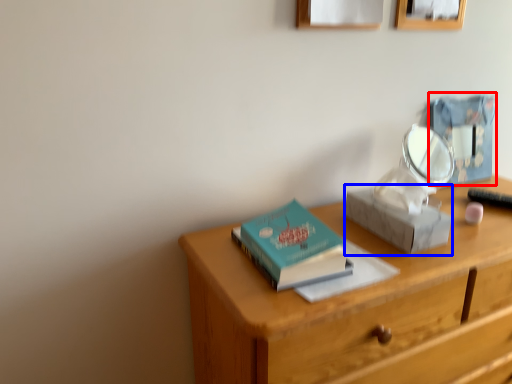
Question: Among these objects, which one is farthest to the camera, box (highlighted by a red box) or shoe box (highlighted by a blue box)?

Choices:
 (A) box
 (B) shoe box

Answer: (A)